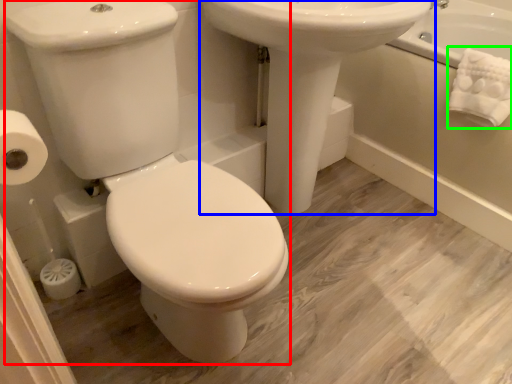
Question: Considering the real-world distances, which object is farthest from porcelain (highlighted by a red box)? sink (highlighted by a blue box) or bath towel (highlighted by a green box)?

Choices:
 (A) sink
 (B) bath towel

Answer: (B)